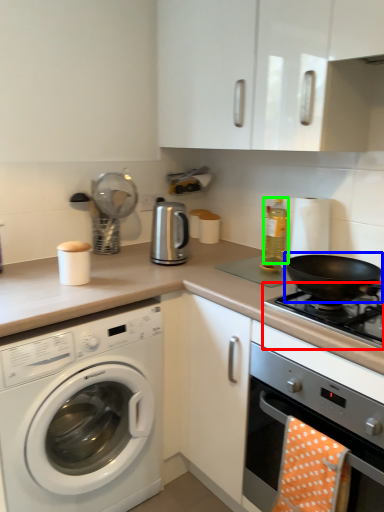
Question: Which is nearer to the gas stove (highlighted by a red box)? wok (highlighted by a blue box) or bottle (highlighted by a green box).

Choices:
 (A) wok
 (B) bottle

Answer: (A)